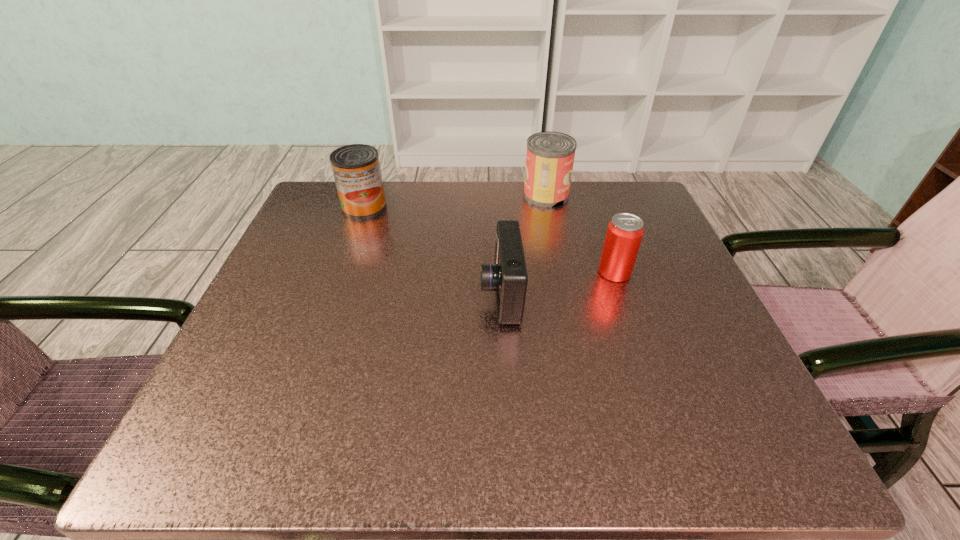
This screenshot has height=540, width=960. I want to click on the third object from left to right, so click(x=550, y=156).

The height and width of the screenshot is (540, 960). Identify the location of the leftmost object. (356, 168).

You are a GUI agent. You are given a task and a screenshot of the screen. Output one action in this format:
    pyautogui.click(x=<x>, y=<y>)
    Task: Click on the rightmost can
    This screenshot has height=540, width=960.
    Given the screenshot: What is the action you would take?
    pyautogui.click(x=624, y=234)

Find the location of `the rightmost object`. the rightmost object is located at coordinates (624, 234).

At what (x,y) coordinates should I click in order to perform the action: click on the third object from right to left. Please return your answer as a coordinate pair (x, y). The width and height of the screenshot is (960, 540). Looking at the image, I should click on (508, 276).

Identify the location of vacant position located 0.370m on the front of the third object from left to right. This screenshot has height=540, width=960. (573, 326).

Locate an element on the screen. This screenshot has height=540, width=960. vacant area located on the right of the leftmost can is located at coordinates (506, 207).

You are a GUI agent. You are given a task and a screenshot of the screen. Output one action in this format:
    pyautogui.click(x=<x>, y=<y>)
    Task: Click on the vacant region located 0.140m on the left of the rightmost can
    
    Given the screenshot: What is the action you would take?
    pyautogui.click(x=527, y=273)

The image size is (960, 540). I want to click on free region located on the front-facing side of the camera, so click(303, 294).

Find the location of a particular element. Image resolution: width=960 pixels, height=540 pixels. blank space located 0.050m on the front-facing side of the camera is located at coordinates (454, 294).